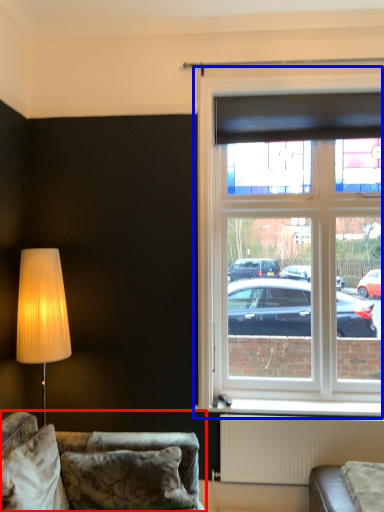
Question: Which of the following is the closest to the observer, studio couch (highlighted by a red box) or window (highlighted by a blue box)?

Choices:
 (A) studio couch
 (B) window

Answer: (A)